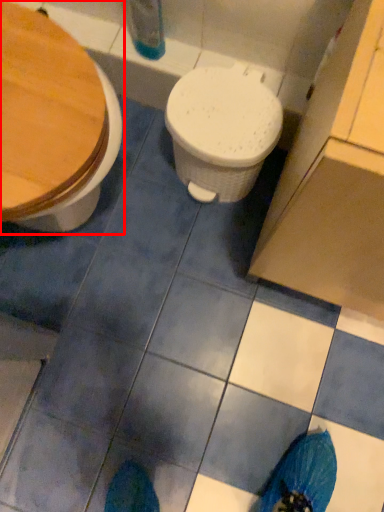
Question: From the image's perspective, where is toilet (annotated by the red box) located relative to toilet?

Choices:
 (A) below
 (B) above

Answer: (A)